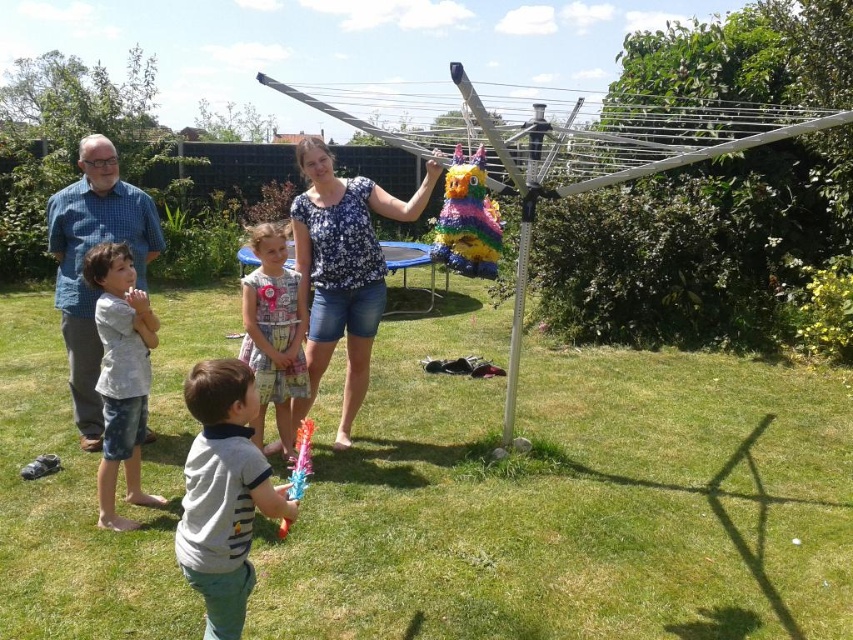
Question: Is floral blouse at center above gray cotton shirt at center?

Choices:
 (A) no
 (B) yes

Answer: (B)

Question: Is floral blouse at center behind multicolored paper pinata at center?

Choices:
 (A) yes
 (B) no

Answer: (A)

Question: Which object is farther from the camera taking this photo?

Choices:
 (A) printed cotton dress at center
 (B) blue checkered shirt at left
 (C) translucent plastic pinata at center
 (D) gray cotton shirt at left

Answer: (B)

Question: Which point is farther from the camera taking this photo?

Choices:
 (A) (96, 368)
 (B) (279, 397)

Answer: (A)

Question: Does gray cotton shirt at left have a larger size compared to printed cotton dress at center?

Choices:
 (A) yes
 (B) no

Answer: (A)

Question: Which of the following is the farthest from the observer?

Choices:
 (A) (306, 145)
 (B) (473, 260)
 (C) (305, 419)
 (D) (91, 323)

Answer: (D)